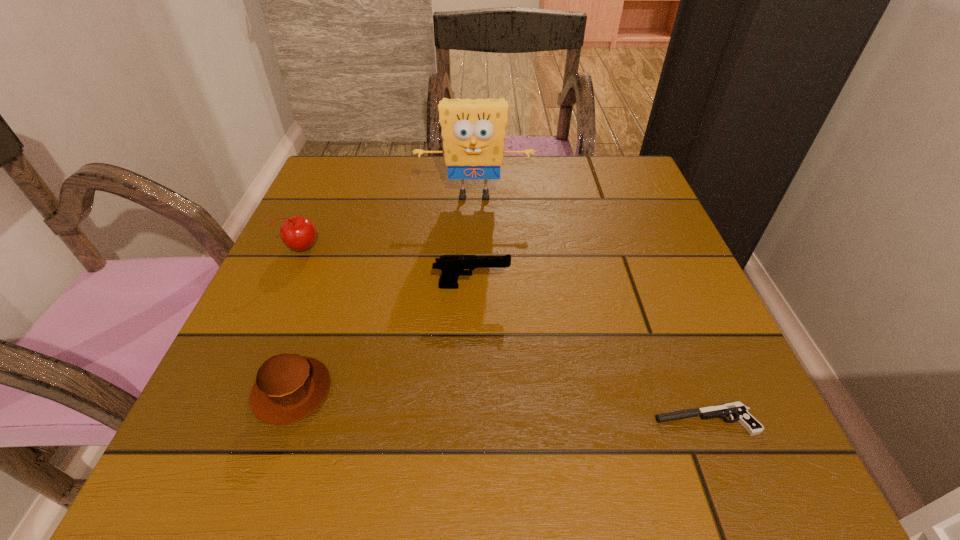
Locate an element on the screen. the tallest object is located at coordinates (x=473, y=131).

Locate an element on the screen. sponge is located at coordinates (473, 131).

This screenshot has height=540, width=960. What are the coordinates of `cherry` in the screenshot? It's located at (299, 233).

The height and width of the screenshot is (540, 960). In order to click on the farther pistol in this screenshot , I will do `click(452, 266)`.

At what (x,y) coordinates should I click in order to perform the action: click on the taller pistol. Please return your answer as a coordinate pair (x, y). The height and width of the screenshot is (540, 960). Looking at the image, I should click on (452, 266).

Locate an element on the screen. the second shortest object is located at coordinates (289, 387).

You are a GUI agent. You are given a task and a screenshot of the screen. Output one action in this format:
    pyautogui.click(x=<x>, y=<y>)
    Task: Click on the nearer pistol
    This screenshot has height=540, width=960.
    Given the screenshot: What is the action you would take?
    pyautogui.click(x=737, y=409)

This screenshot has height=540, width=960. I want to click on the shorter pistol, so click(x=737, y=409).

Where is `free space located on the face of the tallest object`? The height and width of the screenshot is (540, 960). free space located on the face of the tallest object is located at coordinates 474,225.

Locate an element on the screen. vacant position located on the right of the fourth nearest object is located at coordinates (468, 247).